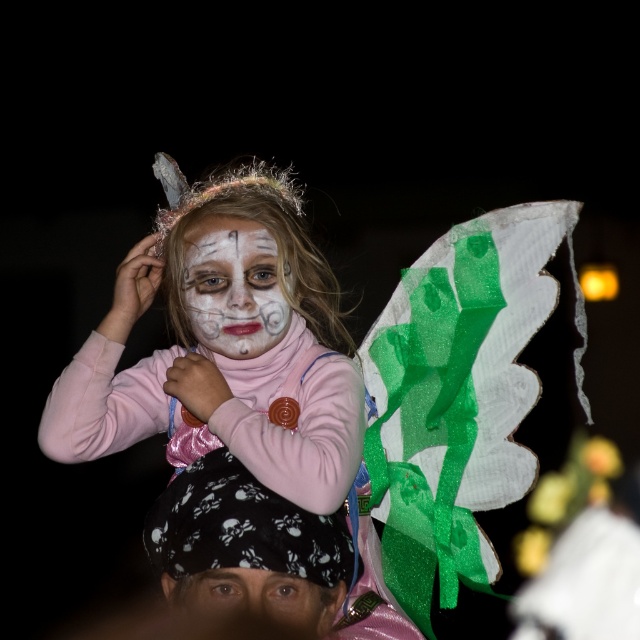
The young girl is holding a small toy in her hand. She wants to place it between her matte pink sweater at center and smooth skin eyes at center. Which side should she place it on?

The matte pink sweater at center is on the left side of the smooth skin eyes at center, so she should place the toy to the right of the matte pink sweater at center or to the left of the smooth skin eyes at center.

You are a photographer adjusting your camera settings to focus on two specific points in the image. The first point is point (x=308, y=406) and the second is point (x=240, y=292). Which point should you focus on first to ensure the closest object is in sharp focus?

Point (x=308, y=406) is closer to the viewer than point (x=240, y=292), so you should focus on point (x=308, y=406) first to ensure the closest object is in sharp focus.

The girl has a costume with specific features. If you were to measure the distance between the white matte face paint at center and the smooth skin eyes at center on her face, what would it be?

The distance between the white matte face paint at center and the smooth skin eyes at center is 21.10 inches.